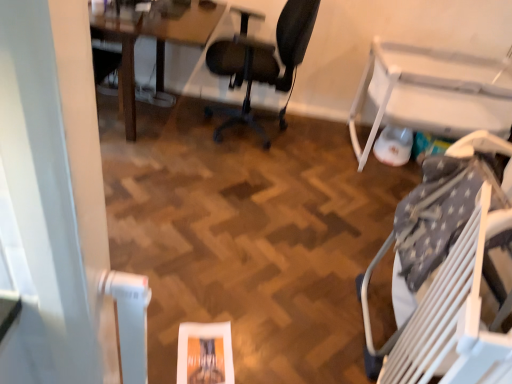
Locate an element on the screen. Image resolution: width=512 pixels, height=384 pixels. vacant space to the right of black mesh office chair at center, the second chair when ordered from bottom to top is located at coordinates (313, 148).